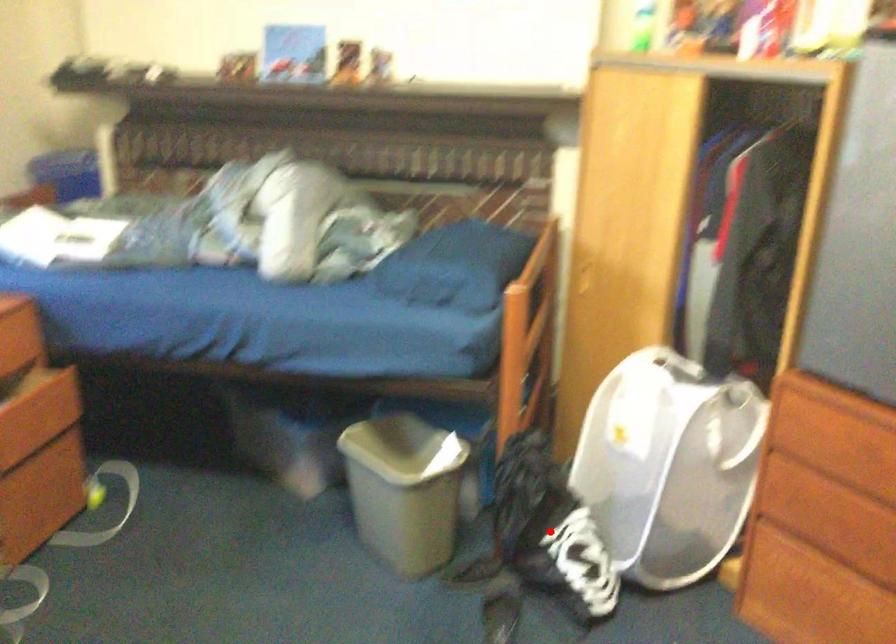
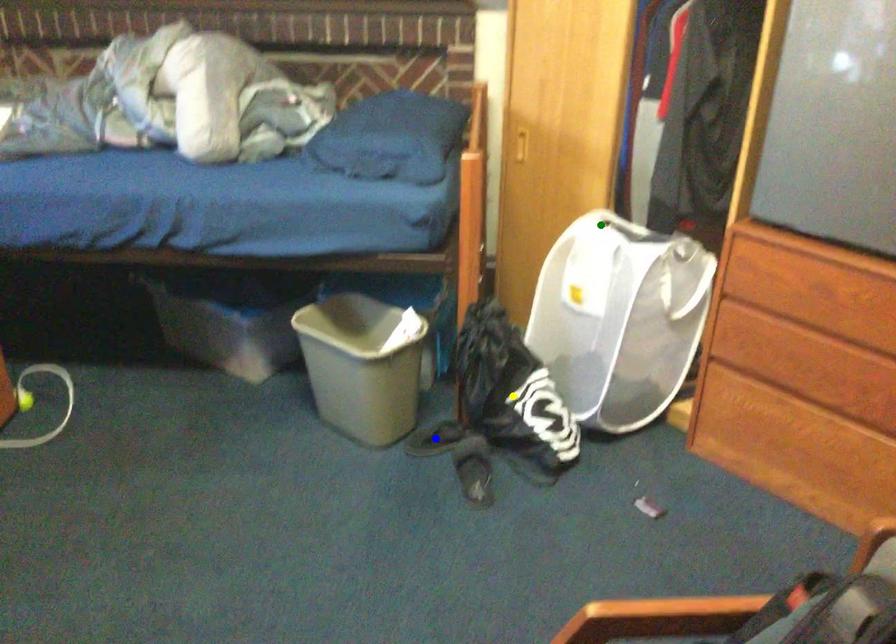
Question: I am providing you with two images of the same scene from different viewpoints. A red point is marked on the first image. You are given multiple points on the second image. Which spot in image 2 lines up with the point in image 1?

Choices:
 (A) blue point
 (B) yellow point
 (C) green point

Answer: (B)